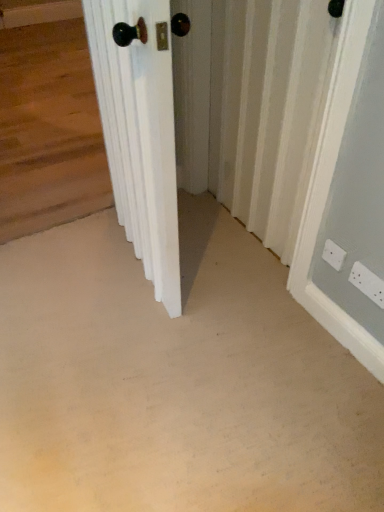
Question: Does white wooden door at center have a greater width compared to white textured radiator at center?

Choices:
 (A) no
 (B) yes

Answer: (B)

Question: Is white wooden door at center completely or partially outside of white textured radiator at center?

Choices:
 (A) yes
 (B) no

Answer: (A)

Question: From a real-world perspective, is white wooden door at center over white textured radiator at center?

Choices:
 (A) yes
 (B) no

Answer: (A)

Question: Does white wooden door at center lie behind white textured radiator at center?

Choices:
 (A) yes
 (B) no

Answer: (B)

Question: Does white wooden door at center have a lesser width compared to white textured radiator at center?

Choices:
 (A) no
 (B) yes

Answer: (A)

Question: In terms of height, does white plastic electric outlet at lower right, which is the first electric outlet in left-to-right order, look taller or shorter compared to white textured radiator at center?

Choices:
 (A) short
 (B) tall

Answer: (A)

Question: In terms of size, does white plastic electric outlet at lower right, which is the first electric outlet in left-to-right order, appear bigger or smaller than white textured radiator at center?

Choices:
 (A) small
 (B) big

Answer: (A)

Question: Do you think white plastic electric outlet at lower right, which is the first electric outlet in left-to-right order, is within white textured radiator at center, or outside of it?

Choices:
 (A) inside
 (B) outside

Answer: (B)

Question: In terms of width, does white plastic electric outlet at lower right, which is the first electric outlet in left-to-right order, look wider or thinner when compared to white textured radiator at center?

Choices:
 (A) wide
 (B) thin

Answer: (B)

Question: From the image's perspective, is white plastic electric outlet at lower right, which is the first electric outlet in left-to-right order, located above or below beige carpet at center?

Choices:
 (A) above
 (B) below

Answer: (A)

Question: From a real-world perspective, is white plastic electric outlet at lower right, the second electric outlet from the right, above or below beige carpet at center?

Choices:
 (A) below
 (B) above

Answer: (B)

Question: Considering their positions, is white plastic electric outlet at lower right, the second electric outlet from the right, located in front of or behind beige carpet at center?

Choices:
 (A) front
 (B) behind

Answer: (B)

Question: Considering the positions of point (334, 262) and point (261, 300), is point (334, 262) closer or farther from the camera than point (261, 300)?

Choices:
 (A) closer
 (B) farther

Answer: (A)

Question: Looking at their shapes, would you say white plastic electric outlet at lower right, acting as the 2th electric outlet starting from the left, is wider or thinner than white wooden door at center?

Choices:
 (A) wide
 (B) thin

Answer: (B)

Question: Is white plastic electric outlet at lower right, acting as the 2th electric outlet starting from the left, to the left or to the right of white wooden door at center in the image?

Choices:
 (A) left
 (B) right

Answer: (B)